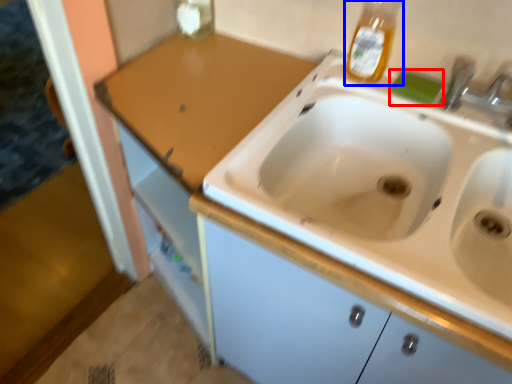
Question: Which point is further to the camera, soap (highlighted by a red box) or bottle (highlighted by a blue box)?

Choices:
 (A) soap
 (B) bottle

Answer: (A)